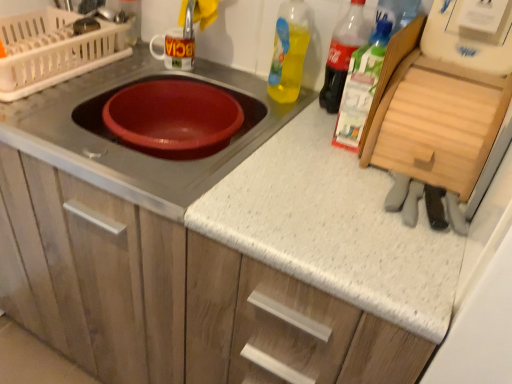
Where is `free space in front of translucent plastic bottle at upper right, arranged as the 2th bottle when viewed from the left`? free space in front of translucent plastic bottle at upper right, arranged as the 2th bottle when viewed from the left is located at coordinates (312, 140).